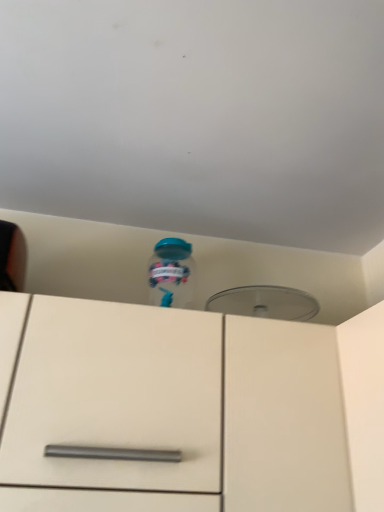
The height and width of the screenshot is (512, 384). What do you see at coordinates (171, 273) in the screenshot? I see `translucent plastic bottle at center` at bounding box center [171, 273].

Where is `translucent plastic bottle at center`? The width and height of the screenshot is (384, 512). translucent plastic bottle at center is located at coordinates (171, 273).

What are the coordinates of `translucent plastic bottle at center` in the screenshot? It's located at (171, 273).